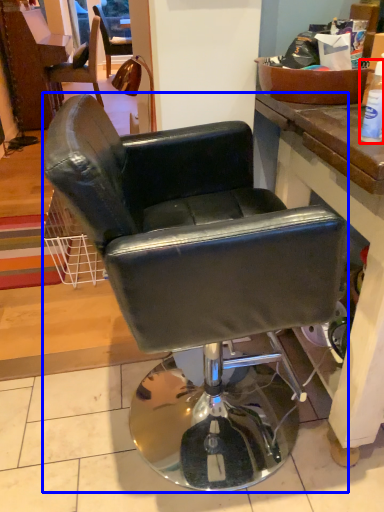
Question: Among these objects, which one is farthest to the camera, bottle (highlighted by a red box) or chair (highlighted by a blue box)?

Choices:
 (A) bottle
 (B) chair

Answer: (A)